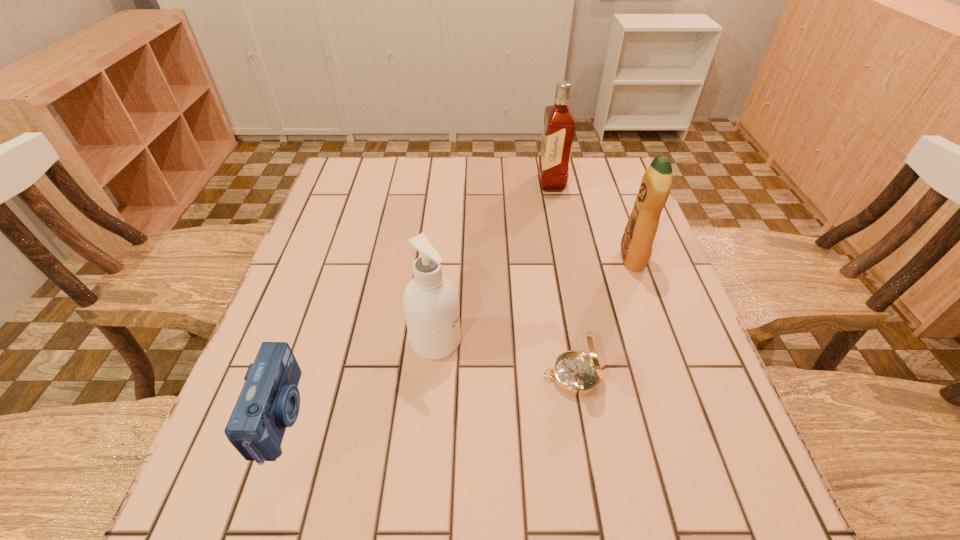
Locate an element on the screen. This screenshot has height=540, width=960. the farthest object is located at coordinates (559, 125).

The height and width of the screenshot is (540, 960). Find the location of `detergent`. detergent is located at coordinates (636, 245).

Find the location of a particular element. The image size is (960, 540). the second farthest object is located at coordinates pos(636,245).

Image resolution: width=960 pixels, height=540 pixels. I want to click on the second object from left to right, so click(431, 303).

You are a GUI agent. You are given a task and a screenshot of the screen. Output one action in this format:
    pyautogui.click(x=<x>, y=<y>)
    Task: Click on the compass
    The image size is (960, 540).
    Given the screenshot: What is the action you would take?
    pyautogui.click(x=576, y=373)

The image size is (960, 540). In order to click on the leftmost object in this screenshot , I will do `click(269, 401)`.

Identify the location of free space located on the front label of the liquor. This screenshot has height=540, width=960. (483, 183).

Identify the location of vacant area situated 0.240m on the front label of the liquor. The image size is (960, 540). (460, 183).

Find the location of a particular element. The height and width of the screenshot is (540, 960). vacant space situated 0.230m on the front label of the liquor is located at coordinates pos(463,183).

Locate an element on the screen. The width and height of the screenshot is (960, 540). free space located 0.230m on the label of the second farthest object is located at coordinates (527, 258).